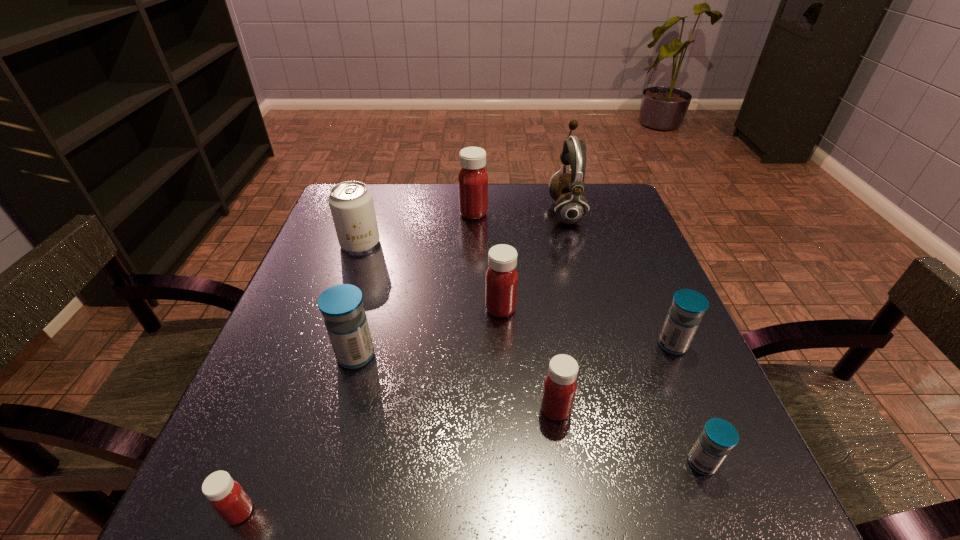
The height and width of the screenshot is (540, 960). Find the location of `earphone that is at the right edge`. earphone that is at the right edge is located at coordinates (566, 189).

Identify the location of object that is at the near left corner. (226, 496).

You are a GUI agent. You are given a task and a screenshot of the screen. Output one action in this format:
    pyautogui.click(x=<x>, y=<y>)
    Task: Click on the object at the far right corner
    
    Given the screenshot: What is the action you would take?
    pyautogui.click(x=566, y=189)

I want to click on object that is positioned at the near right corner, so click(x=718, y=437).

Image resolution: width=960 pixels, height=540 pixels. Identify the location of free space at the far edge of the desktop. (455, 198).

The image size is (960, 540). What are the coordinates of `vacant area at the near edge of the desktop` in the screenshot? It's located at (485, 518).

In the image, there is a desktop. Identify the location of free space at the left edge. (340, 248).

Find the location of `free region at the right edge`. free region at the right edge is located at coordinates (658, 326).

Where is `free region at the far right corner of the desktop`? free region at the far right corner of the desktop is located at coordinates (607, 185).

I want to click on empty space between the third object from right to left and the sixth object from left to right, so click(x=561, y=310).